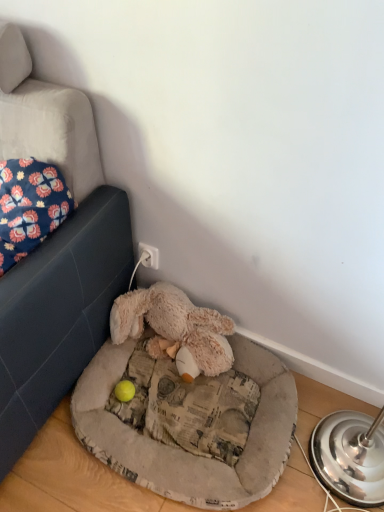
What do you see at coordinates (29, 207) in the screenshot? I see `floral fabric pillow at upper left` at bounding box center [29, 207].

Where is `fluffy beige stuffed animal at lower center`? fluffy beige stuffed animal at lower center is located at coordinates (175, 324).

Between fluffy beige stuffed animal at lower center and fluffy beige dog bed at lower center, which one appears on the right side from the viewer's perspective?

fluffy beige dog bed at lower center is more to the right.

Is fluffy beige stuffed animal at lower center wider or thinner than fluffy beige dog bed at lower center?

In the image, fluffy beige stuffed animal at lower center appears to be more narrow than fluffy beige dog bed at lower center.

Locate an element on the screen. This screenshot has width=384, height=512. dog bed directly beneath the fluffy beige stuffed animal at lower center (from a real-world perspective) is located at coordinates (192, 423).

Who is bigger, fluffy beige stuffed animal at lower center or fluffy beige dog bed at lower center?

With larger size is fluffy beige dog bed at lower center.

Is fluffy beige dog bed at lower center at the back of floral fabric pillow at upper left?

No, floral fabric pillow at upper left is not facing away from fluffy beige dog bed at lower center.

Find the location of `dog bed below the floral fabric pillow at upper left (from the image's perspective)`. dog bed below the floral fabric pillow at upper left (from the image's perspective) is located at coordinates (192, 423).

Looking at this image, considering the relative sizes of floral fabric pillow at upper left and fluffy beige dog bed at lower center in the image provided, is floral fabric pillow at upper left thinner than fluffy beige dog bed at lower center?

Yes.

From a real-world perspective, which object stands above the other?

floral fabric pillow at upper left.

Is point (28, 216) closer or farther from the camera than point (190, 350)?

Point (28, 216).

Where is `pillow located above the fluffy beige stuffed animal at lower center (from a real-world perspective)`? This screenshot has width=384, height=512. pillow located above the fluffy beige stuffed animal at lower center (from a real-world perspective) is located at coordinates (29, 207).

Which object is wider, floral fabric pillow at upper left or fluffy beige stuffed animal at lower center?

floral fabric pillow at upper left is wider.

How many degrees apart are the facing directions of fluffy beige stuffed animal at lower center and floral fabric pillow at upper left?

1.57 degrees separate the facing orientations of fluffy beige stuffed animal at lower center and floral fabric pillow at upper left.

From a real-world perspective, which object rests below the other?

fluffy beige stuffed animal at lower center is physically lower.

Is fluffy beige stuffed animal at lower center touching floral fabric pillow at upper left?

No, fluffy beige stuffed animal at lower center is not beside floral fabric pillow at upper left.

Does point (203, 404) come closer to viewer compared to point (163, 301)?

Yes, it is.

From the image's perspective, which is below, fluffy beige dog bed at lower center or fluffy beige stuffed animal at lower center?

fluffy beige dog bed at lower center appears lower in the image.

Is fluffy beige dog bed at lower center in front of fluffy beige stuffed animal at lower center?

That is True.

Would you consider fluffy beige dog bed at lower center to be distant from fluffy beige stuffed animal at lower center?

fluffy beige dog bed at lower center is actually quite close to fluffy beige stuffed animal at lower center.

Looking at the image, does fluffy beige dog bed at lower center seem bigger or smaller compared to floral fabric pillow at upper left?

fluffy beige dog bed at lower center is smaller than floral fabric pillow at upper left.

Which is more to the right, fluffy beige dog bed at lower center or floral fabric pillow at upper left?

From the viewer's perspective, fluffy beige dog bed at lower center appears more on the right side.

From the image's perspective, between fluffy beige dog bed at lower center and floral fabric pillow at upper left, who is located below?

From the image's view, fluffy beige dog bed at lower center is below.

Locate an element on the screen. dog bed below the fluffy beige stuffed animal at lower center (from the image's perspective) is located at coordinates (192, 423).

In order to click on dog bed behind the floral fabric pillow at upper left in this screenshot , I will do `click(192, 423)`.

Estimate the real-world distances between objects in this image. Which object is closer to floral fabric pillow at upper left, fluffy beige dog bed at lower center or fluffy beige stuffed animal at lower center?

fluffy beige stuffed animal at lower center lies closer to floral fabric pillow at upper left than the other object.

Considering their positions, is fluffy beige stuffed animal at lower center positioned closer to floral fabric pillow at upper left than fluffy beige dog bed at lower center?

fluffy beige stuffed animal at lower center lies closer to floral fabric pillow at upper left than the other object.

Based on their spatial positions, is fluffy beige stuffed animal at lower center or floral fabric pillow at upper left further from fluffy beige dog bed at lower center?

floral fabric pillow at upper left.

Which object lies nearer to the anchor point fluffy beige stuffed animal at lower center, floral fabric pillow at upper left or fluffy beige dog bed at lower center?

fluffy beige dog bed at lower center lies closer to fluffy beige stuffed animal at lower center than the other object.

Estimate the real-world distances between objects in this image. Which object is closer to fluffy beige stuffed animal at lower center, fluffy beige dog bed at lower center or floral fabric pillow at upper left?

fluffy beige dog bed at lower center.

From the image, which object appears to be farther from fluffy beige dog bed at lower center, floral fabric pillow at upper left or fluffy beige stuffed animal at lower center?

floral fabric pillow at upper left lies further to fluffy beige dog bed at lower center than the other object.

I want to click on toy between floral fabric pillow at upper left and fluffy beige dog bed at lower center from left to right, so click(x=175, y=324).